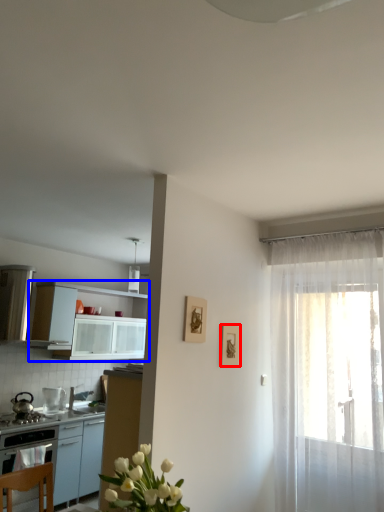
Question: Which point is further to the camera, picture frame (highlighted by a red box) or cabinetry (highlighted by a blue box)?

Choices:
 (A) picture frame
 (B) cabinetry

Answer: (B)